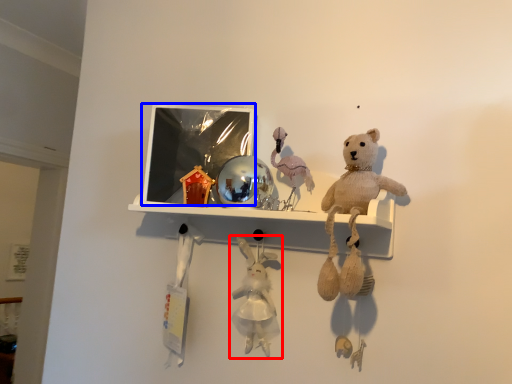
Question: Which object is closer to the camera taking this photo, toy (highlighted by a red box) or picture frame (highlighted by a blue box)?

Choices:
 (A) toy
 (B) picture frame

Answer: (A)